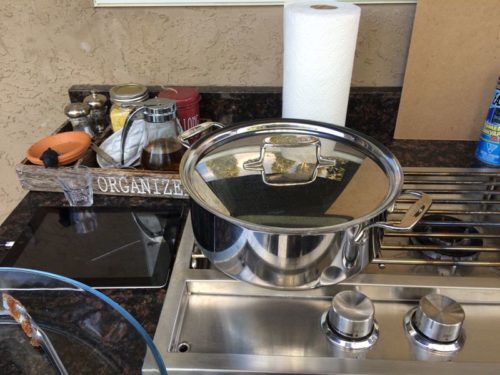
The width and height of the screenshot is (500, 375). What are the coordinates of `wall behind counter space` in the screenshot? It's located at (169, 42).